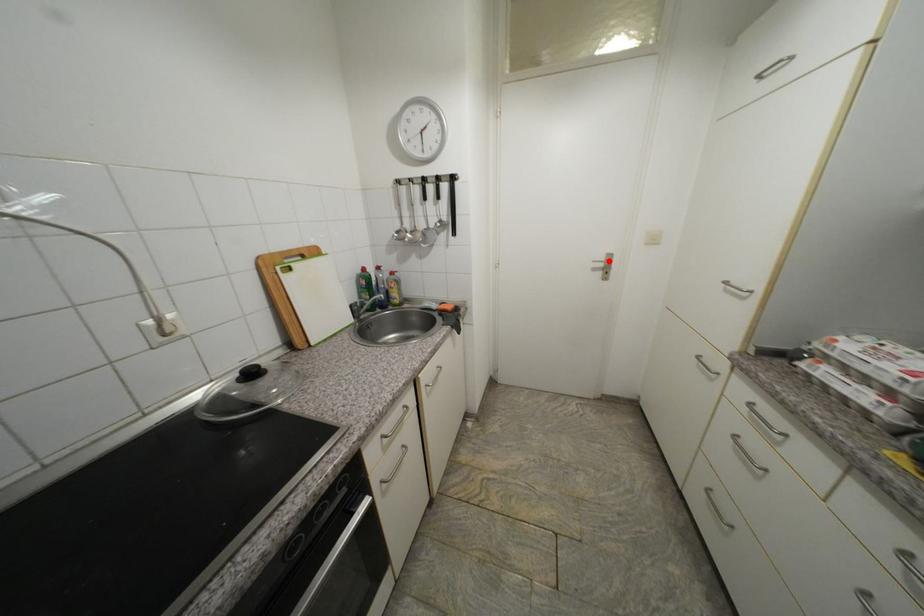
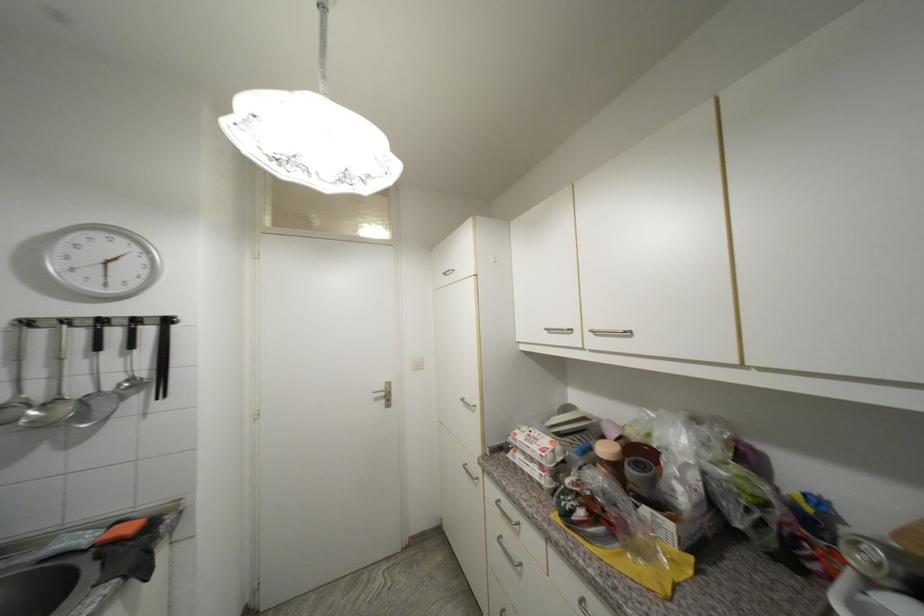
Find the pixel in the second image that matches the highlighted location in the first image.

(388, 390)